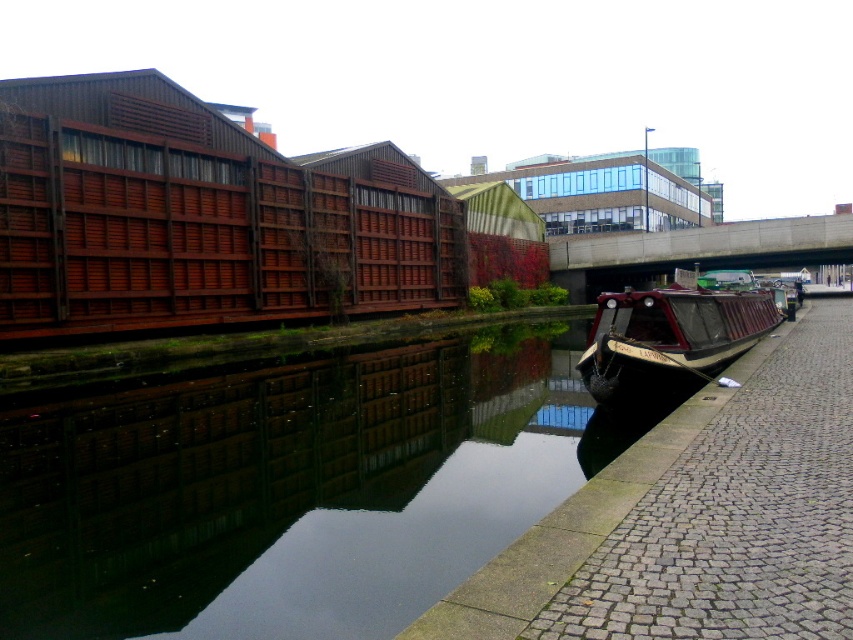
Question: Can you confirm if black reflective water at lower center is positioned below wooden polished barge at right?

Choices:
 (A) yes
 (B) no

Answer: (A)

Question: Can you confirm if black reflective water at lower center is positioned to the left of wooden polished barge at right?

Choices:
 (A) yes
 (B) no

Answer: (A)

Question: Is the position of black reflective water at lower center more distant than that of wooden polished barge at right?

Choices:
 (A) yes
 (B) no

Answer: (B)

Question: Which point appears farthest from the camera in this image?

Choices:
 (A) (741, 314)
 (B) (154, 637)

Answer: (A)